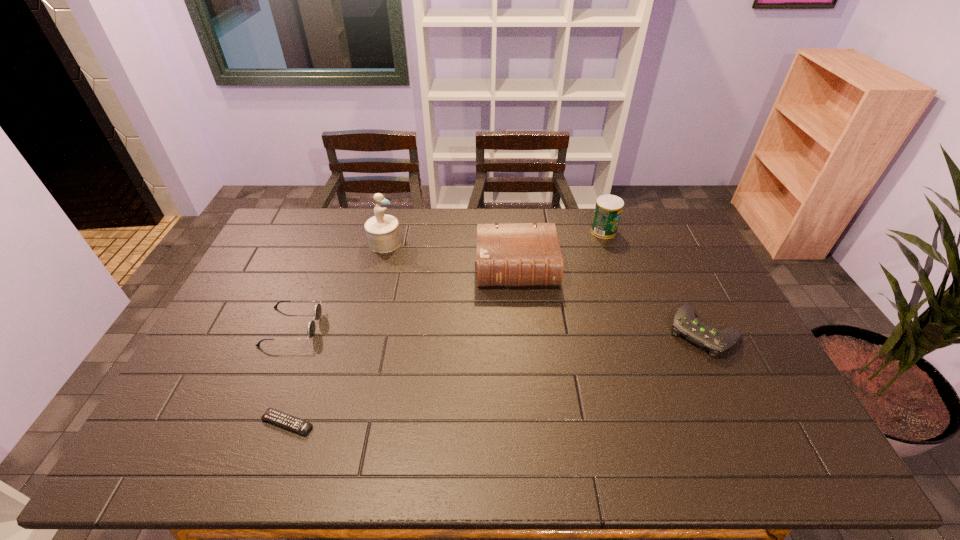
What are the coordinates of `blank space that satisfies the following two spatial constraints: 1. on the front-facing side of the sunglasses; 2. on the back side of the rightmost object` in the screenshot? It's located at (290, 332).

Where is `free space that satisfies the following two spatial constraints: 1. on the front-facing side of the sunglasses; 2. on the left side of the rightmost object`? This screenshot has height=540, width=960. free space that satisfies the following two spatial constraints: 1. on the front-facing side of the sunglasses; 2. on the left side of the rightmost object is located at coordinates (x=290, y=332).